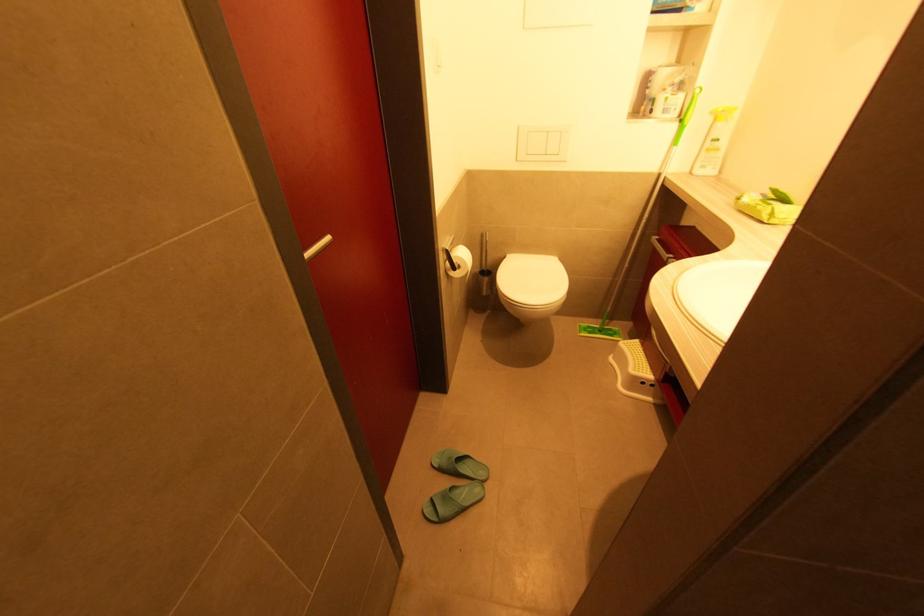
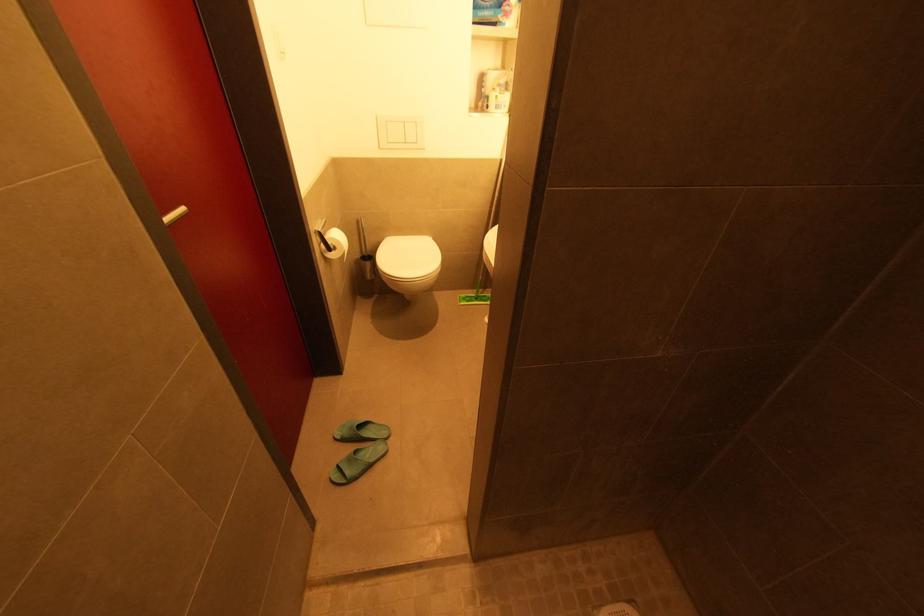
Question: Based on the continuous images, in which direction is the camera rotating? Reply with the corresponding letter.

Choices:
 (A) Left
 (B) Right
 (C) Up
 (D) Down

Answer: (B)